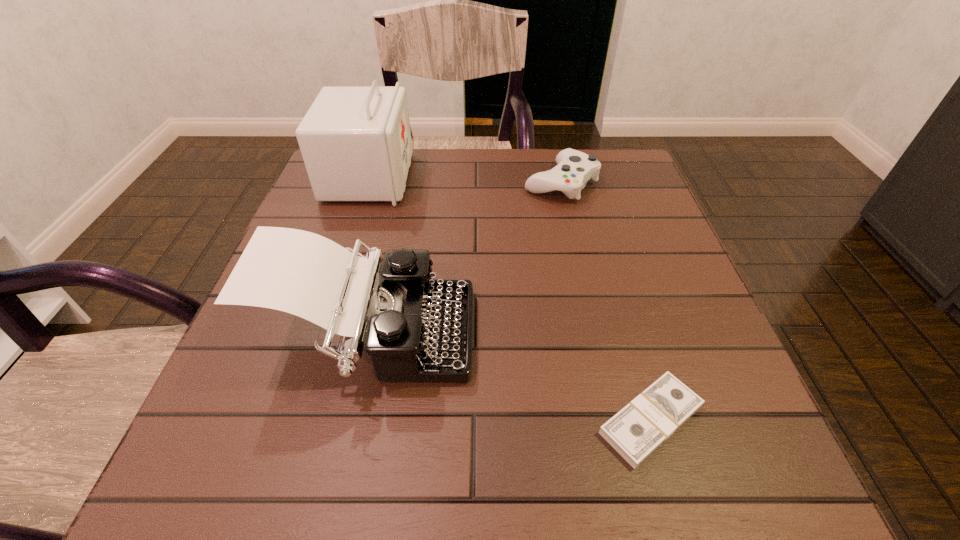
Image resolution: width=960 pixels, height=540 pixels. Identify the location of object present at the near edge. (638, 429).

Find the location of `the first-aid kit present at the left edge`. the first-aid kit present at the left edge is located at coordinates (356, 144).

The image size is (960, 540). In order to click on typewriter situated at the left edge in this screenshot , I will do `click(415, 328)`.

You are a GUI agent. You are given a task and a screenshot of the screen. Output one action in this format:
    pyautogui.click(x=<x>, y=<y>)
    Task: Click on the control present at the right edge
    This screenshot has height=540, width=960.
    Given the screenshot: What is the action you would take?
    pyautogui.click(x=574, y=168)

Find the location of a particular element. This screenshot has width=960, height=540. dollar positioned at the right edge is located at coordinates coord(638,429).

Find the location of `object at the far left corner`. object at the far left corner is located at coordinates (356, 144).

This screenshot has width=960, height=540. In order to click on object located at the far right corner in this screenshot , I will do `click(574, 168)`.

Identify the location of object present at the near right corner. (638, 429).

Image resolution: width=960 pixels, height=540 pixels. What are the coordinates of `blank space at the far edge of the desktop` in the screenshot? It's located at (531, 152).

The height and width of the screenshot is (540, 960). In the image, there is a desktop. In order to click on vacant space at the near edge in this screenshot , I will do `click(298, 489)`.